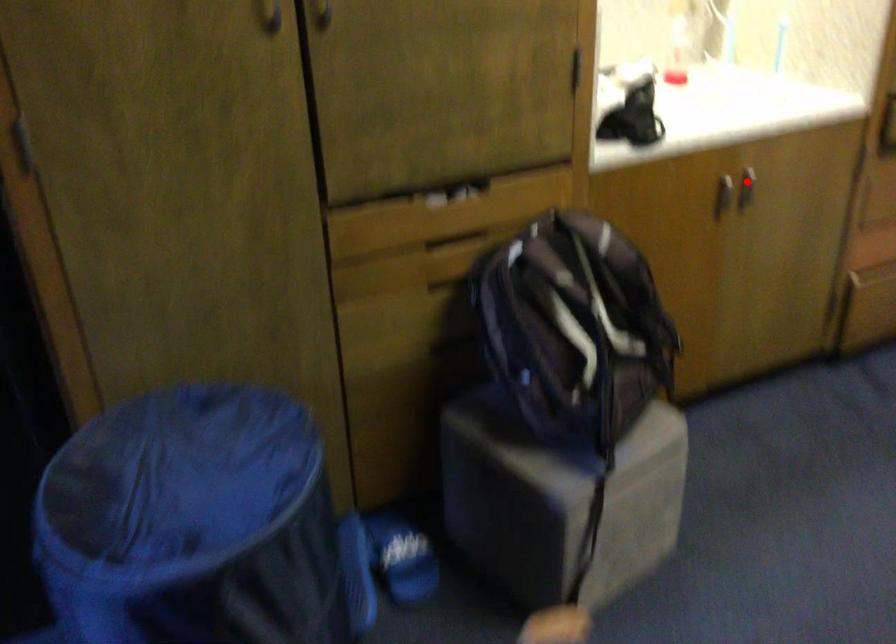
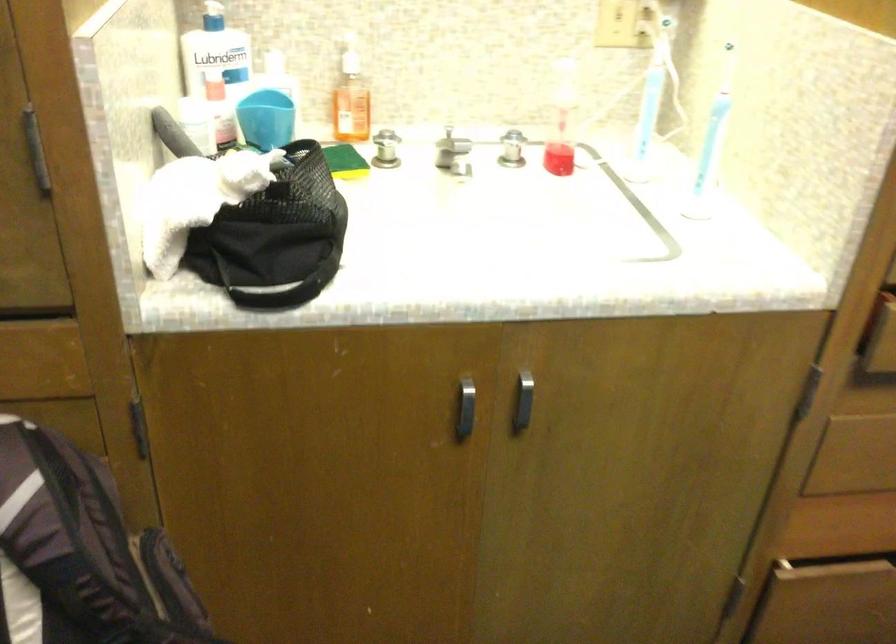
Where in the second image is the point corresponding to the highlighted location from the first image?

(522, 402)